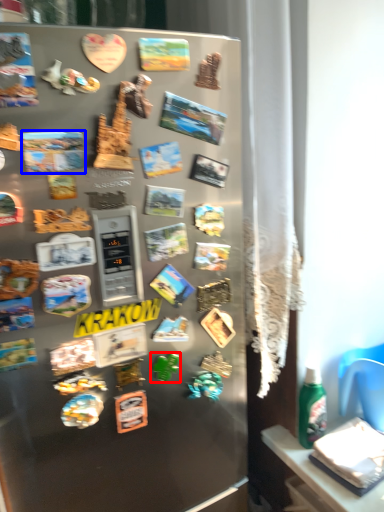
Question: Which object is further to the camera taking this photo, stuff (highlighted by a red box) or comic book (highlighted by a blue box)?

Choices:
 (A) stuff
 (B) comic book

Answer: (A)